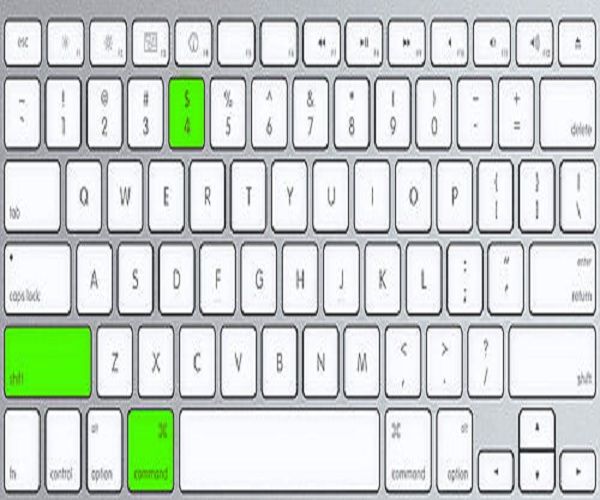
Locate an element on the screen. This screenshot has width=600, height=500. keyboard keys with numbers is located at coordinates (70, 98), (105, 108), (152, 120), (178, 119), (224, 109), (267, 113), (310, 126), (350, 123), (397, 111), (431, 123).